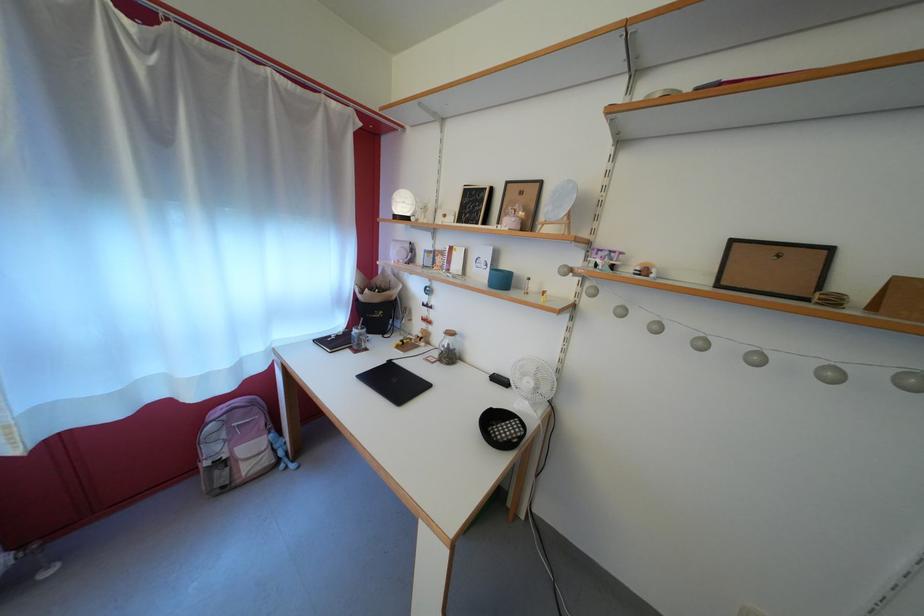
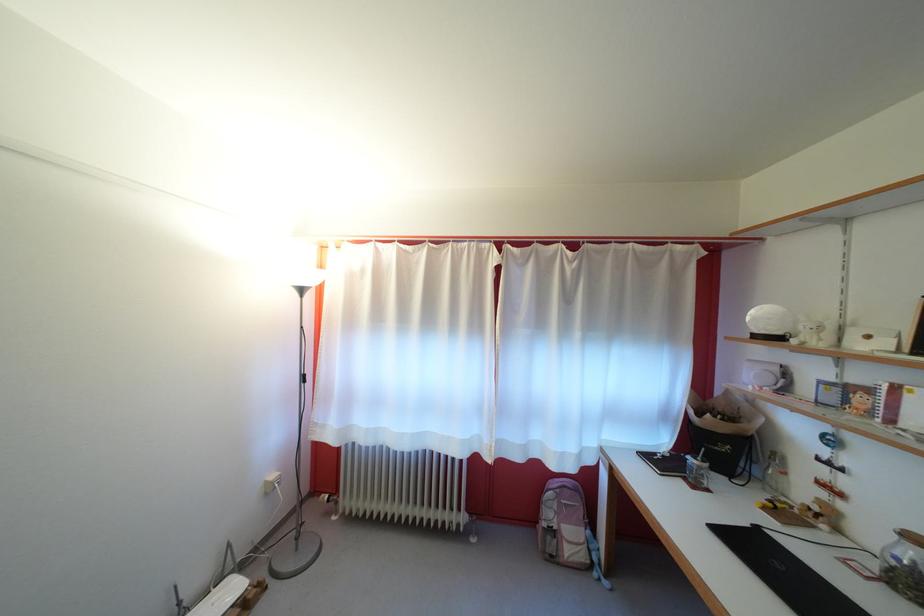
Question: The camera is either moving clockwise (left) or counter-clockwise (right) around the object. The first image is from the beginning of the video and the second image is from the end. Is the camera moving left or right when shooting the video?

Choices:
 (A) Left
 (B) Right

Answer: (B)